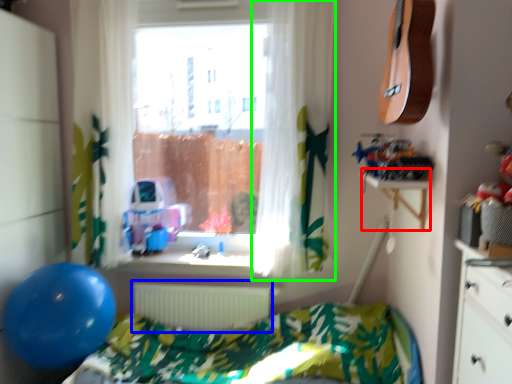
Question: Which object is positioned farthest from table (highlighted by a red box)? Select from radiator (highlighted by a blue box) and curtain (highlighted by a green box).

Choices:
 (A) radiator
 (B) curtain

Answer: (A)